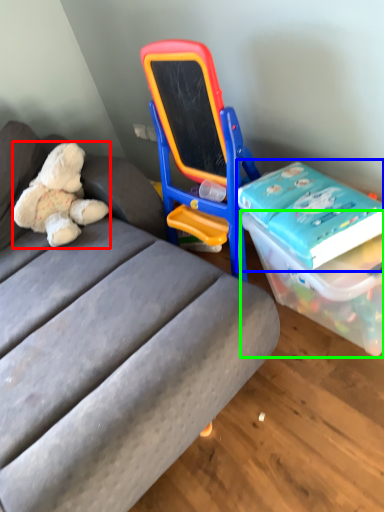
Question: Which object is the farthest from teddy bear (highlighted by a red box)? Choose among these: book (highlighted by a blue box) or box (highlighted by a green box).

Choices:
 (A) book
 (B) box

Answer: (B)